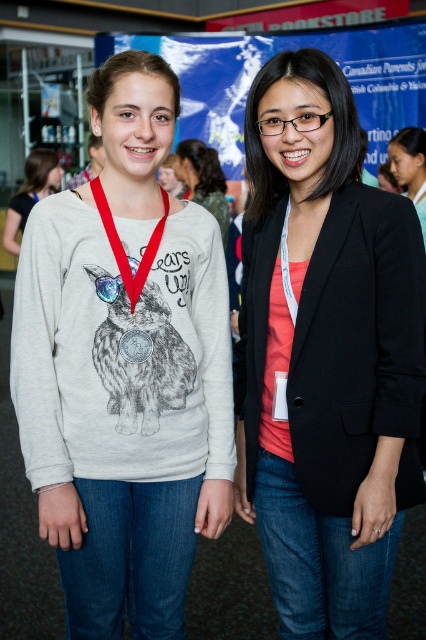
You are a photographer at an event and need to capture a photo where both the matte silver medal at center and the matte gray sweatshirt with rabbit print at center are clearly visible. Since the medal is positioned to the right of the sweatshirt, where should you position your camera relative to the subjects to ensure both are in frame?

Position your camera to the left of the subjects so that the matte silver medal at center, which is to the right of the matte gray sweatshirt with rabbit print at center, remains in view along with the sweatshirt.

You are organizing a photo shoot and need to ensure that the black matte blazer at center and the red fabric lanyard at center are both visible in the frame. Based on their sizes, which object should you prioritize positioning closer to the camera to ensure visibility?

The red fabric lanyard at center is shorter than the black matte blazer at center. Since the lanyard is smaller, you should prioritize positioning it closer to the camera to ensure it remains visible in the frame.

You are at an event and need to identify which item is on the left side between the light gray sweatshirt with rabbit print at center and the red fabric lanyard at center. Can you tell me which one is on the left?

The light gray sweatshirt with rabbit print at center is positioned on the left side of the red fabric lanyard at center, so the sweatshirt is on the left.